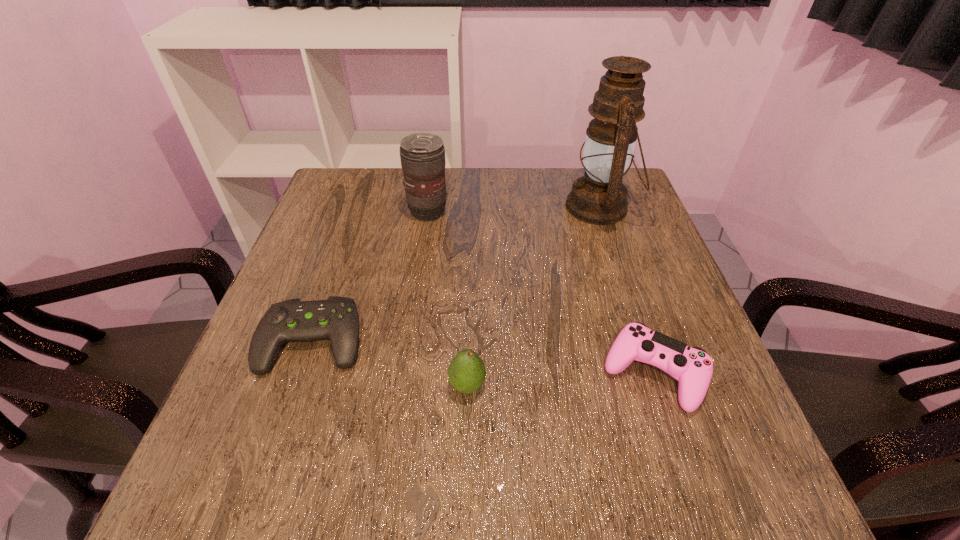
Locate an element on the screen. The image size is (960, 540). the tallest object is located at coordinates (599, 197).

Find the location of `telephoto lens`. telephoto lens is located at coordinates (422, 155).

Find the location of `the fourth object from right to left`. the fourth object from right to left is located at coordinates (422, 155).

This screenshot has height=540, width=960. What are the coordinates of `the third object from right to left` in the screenshot? It's located at (466, 373).

Locate an element on the screen. This screenshot has width=960, height=540. the third shortest object is located at coordinates (466, 373).

Image resolution: width=960 pixels, height=540 pixels. I want to click on the taller control, so click(x=692, y=366).

Identify the location of the second shortest object. Image resolution: width=960 pixels, height=540 pixels. (692, 366).

This screenshot has width=960, height=540. Identify the location of the leftmost object. (337, 319).

Identify the location of the left control. (337, 319).

At what (x,y) coordinates should I click in order to perform the action: click on free space located on the left of the oil lamp. Please return your answer as a coordinate pair (x, y). Looking at the image, I should click on (514, 207).